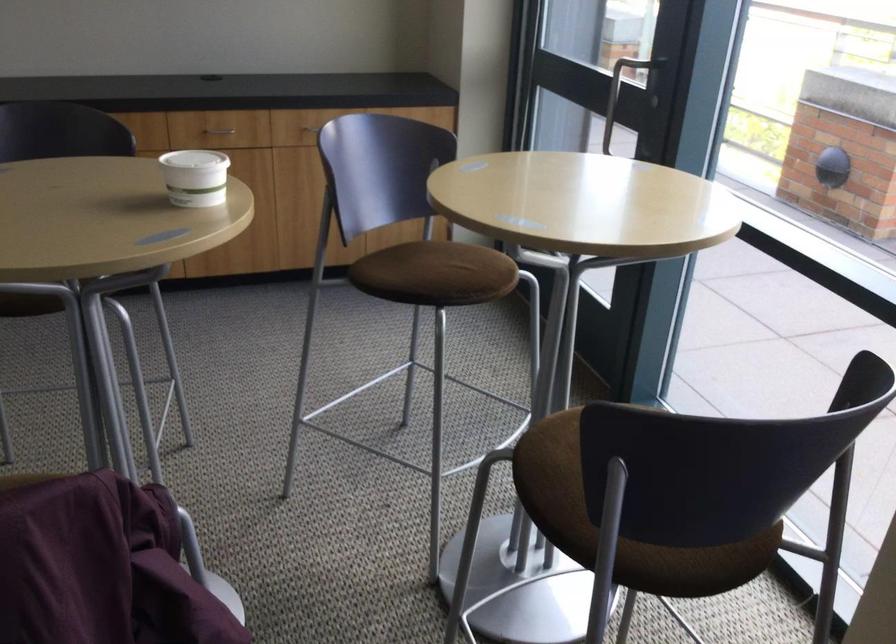
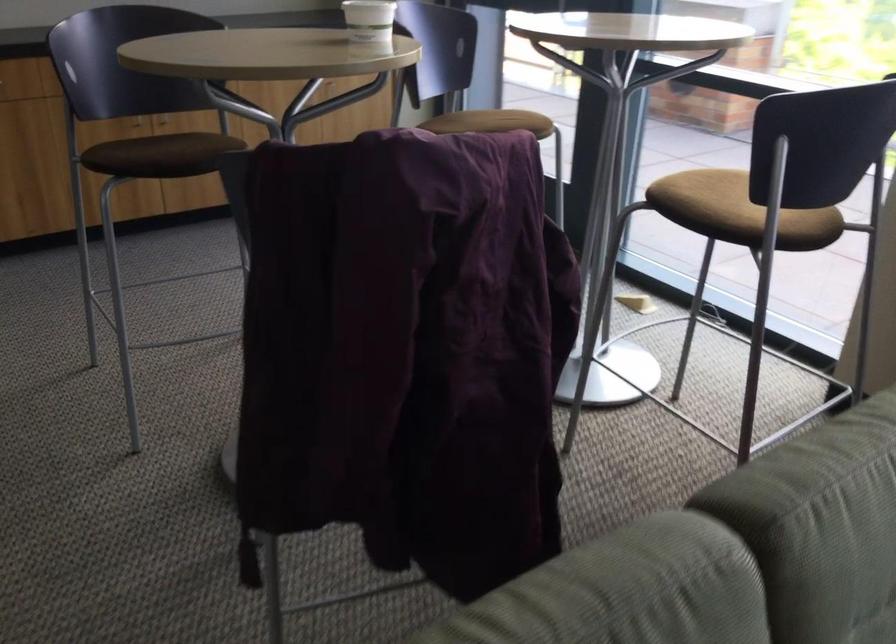
Question: The camera is either moving clockwise (left) or counter-clockwise (right) around the object. The first image is from the beginning of the video and the second image is from the end. Is the camera moving left or right when shooting the video?

Choices:
 (A) Left
 (B) Right

Answer: (A)